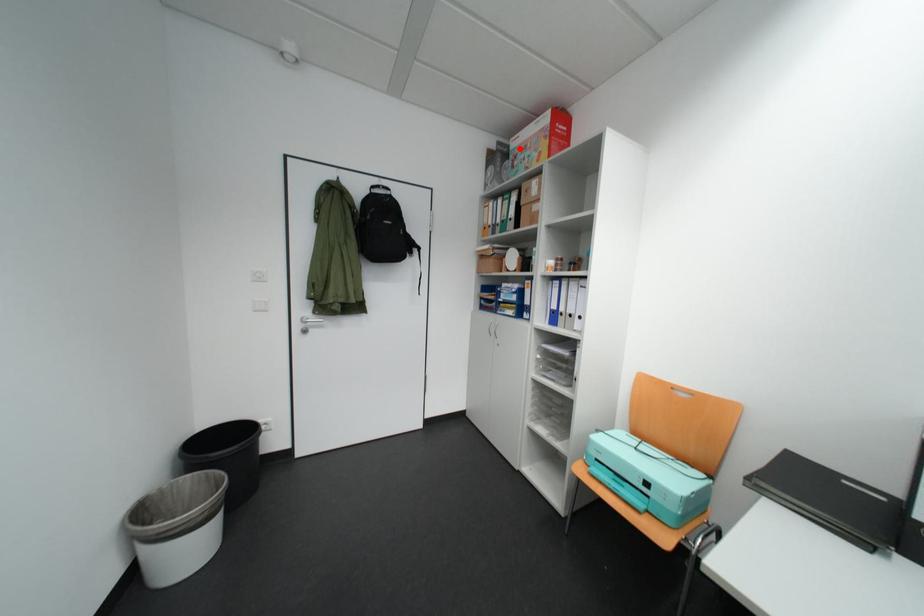
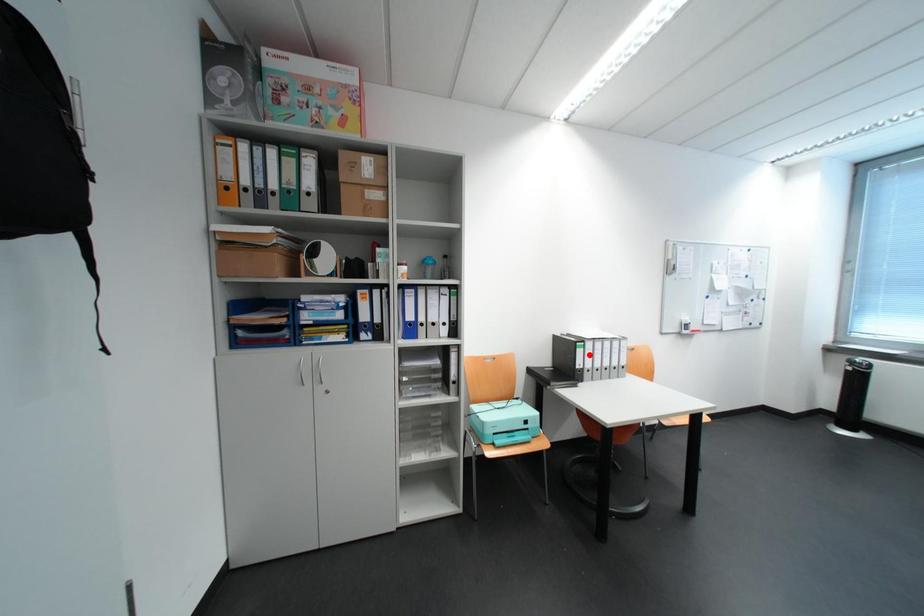
I am providing you with two images of the same scene from different viewpoints. A red point is marked on the first image and another point is marked on the second image. Do the highlighted points in image1 and image2 indicate the same real-world spot?

No